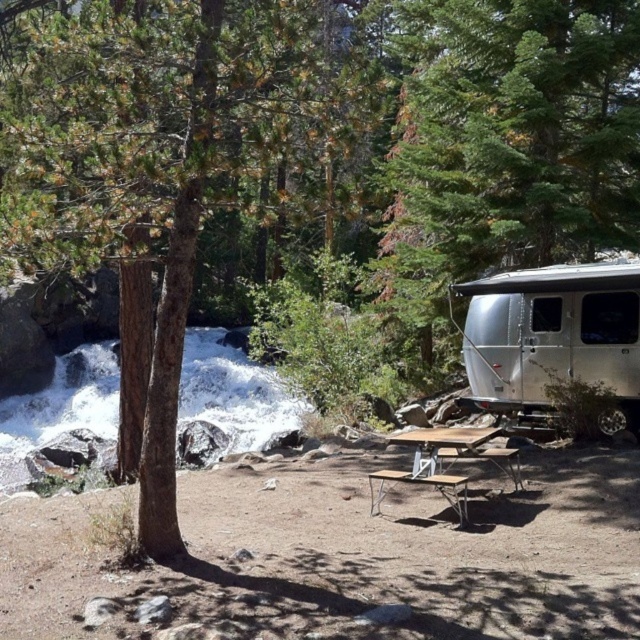
You are planning to set up a tent in the camping area shown. You notice the brown rough tree at center and the white frothy water at left. Based on their positions, which direction should you avoid placing the tent to prevent it from being too close to the water?

You should avoid placing the tent to the left side because the white frothy water at left is located to the left of the brown rough tree at center, meaning the water is on the left side of the scene.

You are standing at the picnic table and want to take a photo of both point (88, 380) and point (477, 428) in the frame. Which point should you focus on first to ensure both are in focus?

You should focus on point (88, 380) first because it is closer to the camera than point (477, 428). This ensures that both points will be in focus when using a single focal point.

You are planning to place a small potted plant on the brown wood picnic table at center. However, you notice the white frothy water at left nearby. Could the potted plant be placed safely on the table without getting wet from the water?

The white frothy water at left is below the brown wood picnic table at center, so the water is lower than the table. Therefore, placing the potted plant on the table should keep it dry and safe from the water.